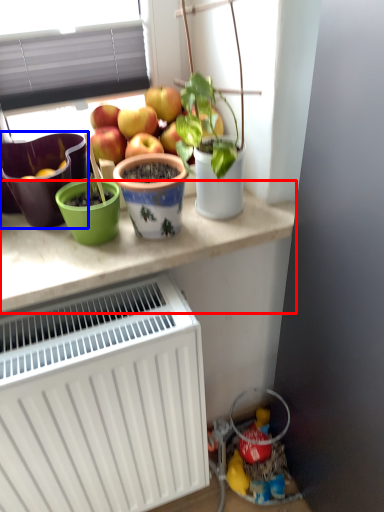
Question: Which object is closer to the camera taking this photo, table (highlighted by a red box) or flowerpot (highlighted by a blue box)?

Choices:
 (A) table
 (B) flowerpot

Answer: (A)